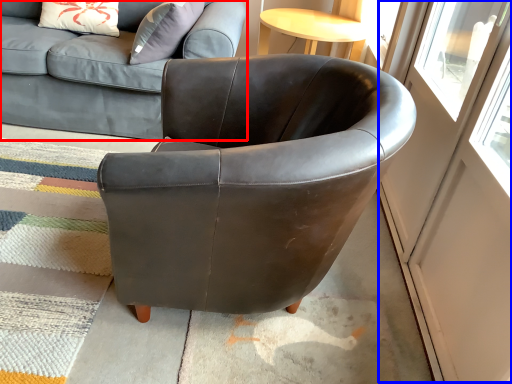
Question: Which object appears closest to the camera in this image, studio couch (highlighted by a red box) or screen door (highlighted by a blue box)?

Choices:
 (A) studio couch
 (B) screen door

Answer: (B)